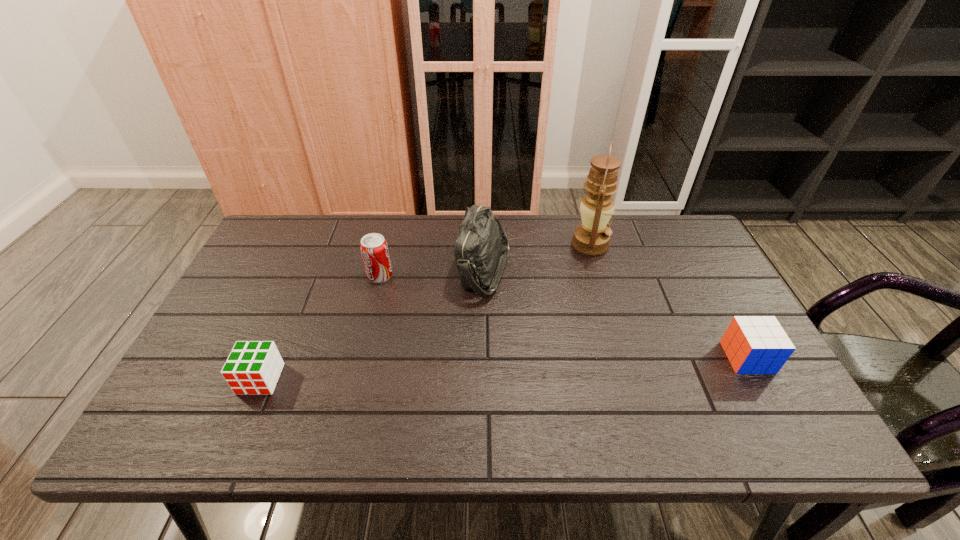
Identify the location of empty space between the right cube and the tallest object. Image resolution: width=960 pixels, height=540 pixels. (669, 301).

Find the location of a particular element. empty space that is in between the third object from right to left and the right cube is located at coordinates (615, 314).

In order to click on vacant area that lies between the shoulder bag and the second object from right to left in this screenshot , I will do `click(537, 257)`.

Identify the location of object that is the closest one to the leftmost object. (374, 250).

This screenshot has width=960, height=540. Find the location of `object that is the closest to the right cube`. object that is the closest to the right cube is located at coordinates (592, 237).

The width and height of the screenshot is (960, 540). In order to click on vacant space that satisfies the following two spatial constraints: 1. at the front padded panel of the fourth shortest object; 2. on the red face of the leftmost object in this screenshot , I will do `click(485, 379)`.

I want to click on vacant space that satisfies the following two spatial constraints: 1. at the front padded panel of the fourth shortest object; 2. on the front side of the soda can, so click(x=484, y=275).

Where is `vacant space that satisfies the following two spatial constraints: 1. at the front padded panel of the second tallest object; 2. on the red face of the left cube`? vacant space that satisfies the following two spatial constraints: 1. at the front padded panel of the second tallest object; 2. on the red face of the left cube is located at coordinates (485, 379).

I want to click on blank area in the image that satisfies the following two spatial constraints: 1. at the front padded panel of the third object from right to left; 2. on the red face of the leftmost object, so click(485, 379).